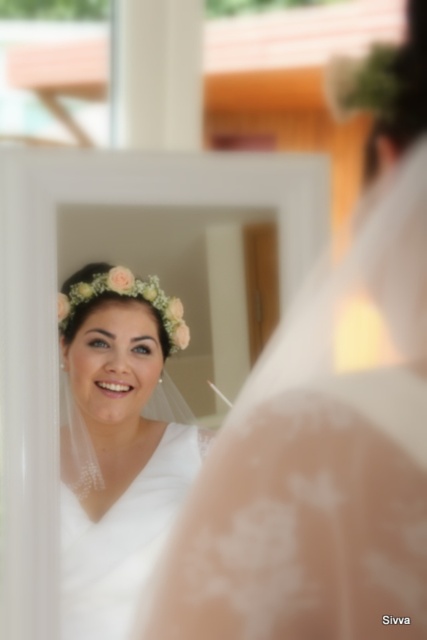
Who is taller, white lace veil at upper left or white lace dress at center?

white lace veil at upper left is taller.

Is white lace veil at upper left wider than white lace dress at center?

Correct, the width of white lace veil at upper left exceeds that of white lace dress at center.

Who is more distant from viewer, (x=370, y=566) or (x=178, y=337)?

Positioned behind is point (x=178, y=337).

At what (x,y) coordinates should I click in order to perform the action: click on white lace veil at upper left. Please return your answer as a coordinate pair (x, y). Looking at the image, I should click on (319, 461).